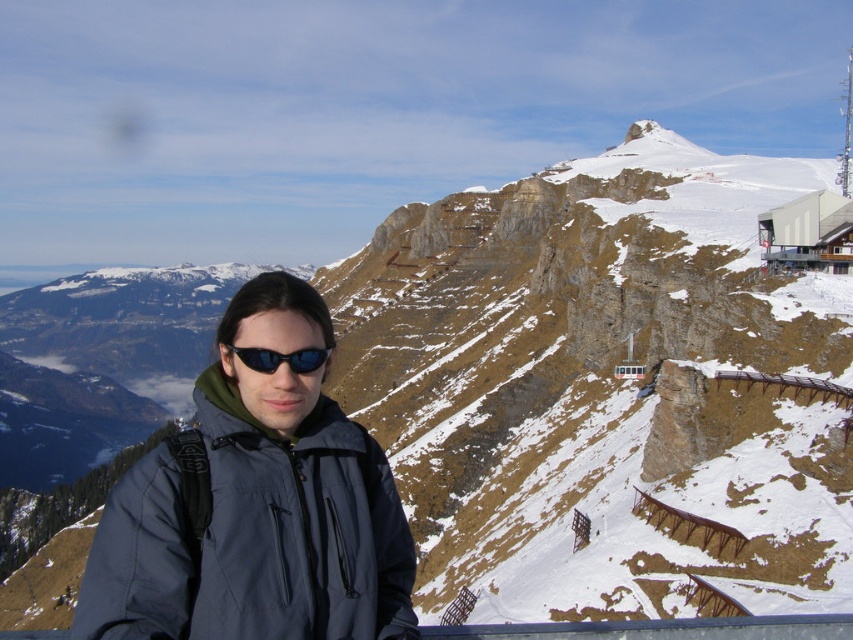
Does dark gray/waterproof jacket at center have a lesser height compared to black matte sunglasses at center?

No.

Who is more distant from viewer, (294, 512) or (315, 348)?

The point (315, 348) is behind.

At what (x,y) coordinates should I click in order to perform the action: click on dark gray/waterproof jacket at center. Please return your answer as a coordinate pair (x, y). The height and width of the screenshot is (640, 853). Looking at the image, I should click on (254, 536).